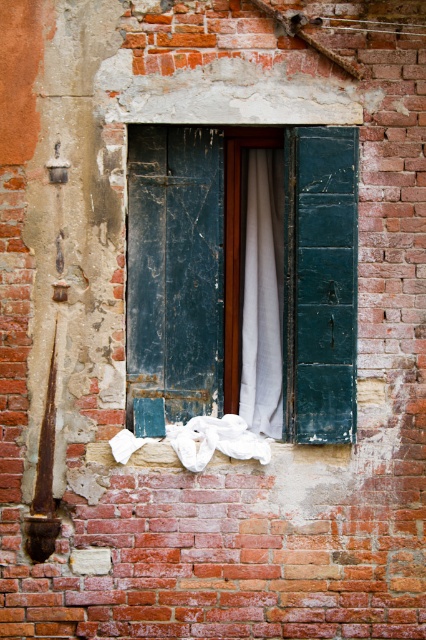
Question: Which object is positioned farthest from the white cotton cloth at lower center?

Choices:
 (A) teal wooden shutters at center
 (B) white fabric curtain at center

Answer: (B)

Question: Can you confirm if white fabric curtain at center is smaller than white cotton cloth at lower center?

Choices:
 (A) yes
 (B) no

Answer: (A)

Question: Which point is closer to the camera?

Choices:
 (A) (299, 150)
 (B) (267, 227)
 (C) (215, 429)

Answer: (A)

Question: Does teal wooden shutters at center come in front of white cotton cloth at lower center?

Choices:
 (A) yes
 (B) no

Answer: (B)

Question: Is white fabric curtain at center to the left of white cotton cloth at lower center from the viewer's perspective?

Choices:
 (A) yes
 (B) no

Answer: (B)

Question: Which point appears farthest from the camera in this image?

Choices:
 (A) (310, 419)
 (B) (118, 438)
 (C) (270, 205)

Answer: (C)